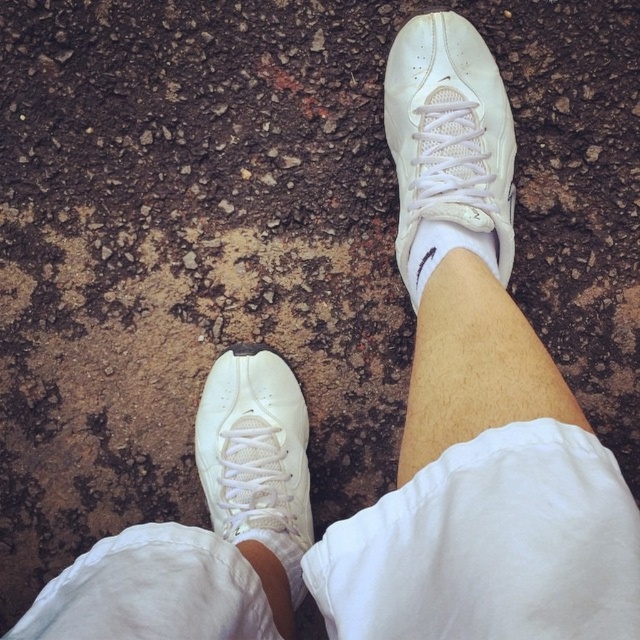
You are standing 3 feet away from the white leather sneaker at center. Can you comfortably reach out and touch it with your hand without moving your feet?

The distance between you and the white leather sneaker at center is 3.30 feet, so yes, you can comfortably reach out and touch it with your hand without moving your feet since 3.30 feet is just slightly more than 3 feet, which is within a comfortable reaching distance.

You are a photographer trying to capture a closeup of the white leather sneaker at center and the white matte skin at center. The camera you are using has a minimum focus distance of 12 inches. Can you focus on both subjects without moving the camera closer?

The white leather sneaker at center and white matte skin at center are 13.08 inches apart from each other. Since the minimum focus distance is 12 inches, the camera cannot focus on both subjects without moving closer because the distance between them exceeds the minimum focus distance.

Looking at the scene described, which object is positioned to the left of the other between the white leather sneaker at center and the white matte skin at center?

The white leather sneaker at center is positioned to the left of the white matte skin at center.